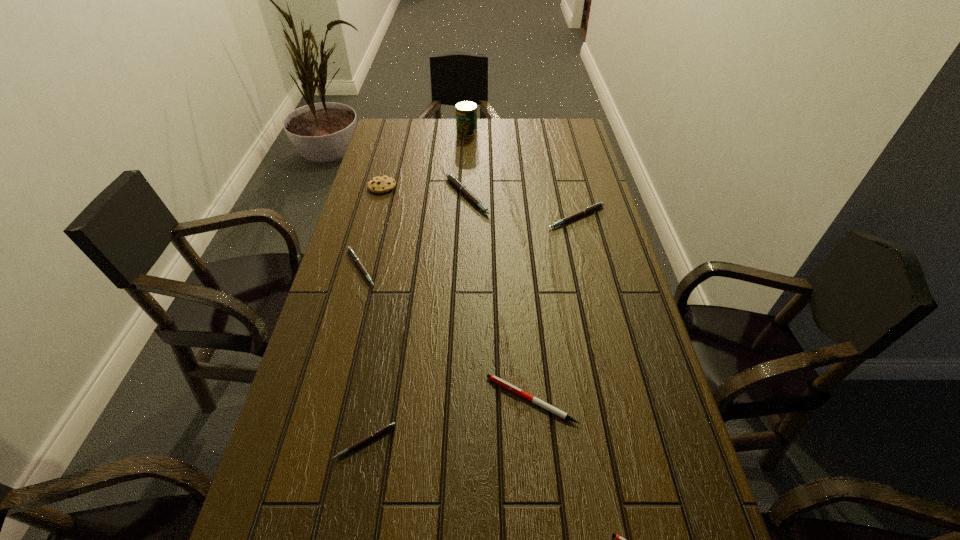
Identify which white pen is the closest to the smallest pink pen. Please provide its 2D coordinates. Your answer should be formatted as a tuple, i.e. [(x, y)], where the tuple contains the x and y coordinates of a point satisfying the conditions above.

[(495, 379)]

Where is `free space in the image that satisfies the following two spatial constraints: 1. at the nib of the second tallest pen; 2. at the nib of the fifth farthest object`? Image resolution: width=960 pixels, height=540 pixels. free space in the image that satisfies the following two spatial constraints: 1. at the nib of the second tallest pen; 2. at the nib of the fifth farthest object is located at coordinates (588, 268).